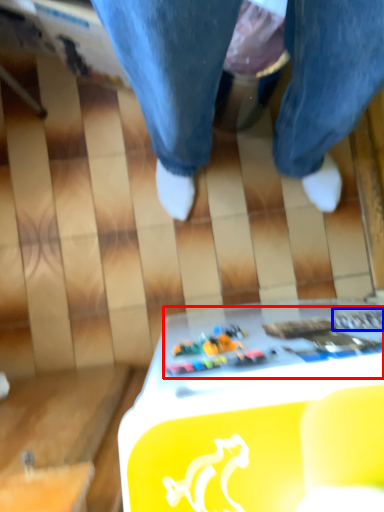
Question: Which object is further to the camera taking this photo, writing (highlighted by a red box) or writing (highlighted by a blue box)?

Choices:
 (A) writing
 (B) writing

Answer: (B)